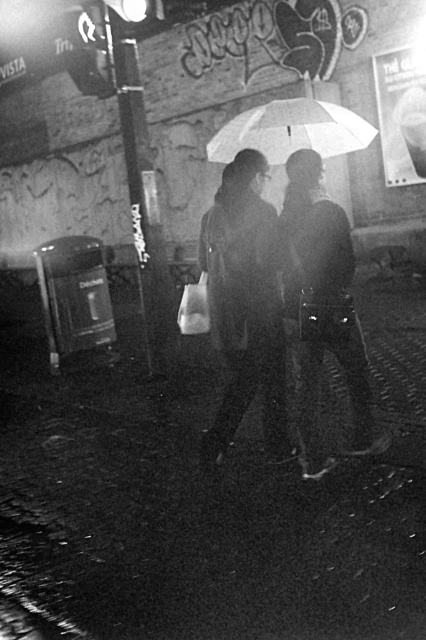
Can you confirm if matte black umbrella at center is wider than white matte umbrella at upper center?

Correct, the width of matte black umbrella at center exceeds that of white matte umbrella at upper center.

Who is positioned more to the right, matte black umbrella at center or white matte umbrella at upper center?

Positioned to the right is white matte umbrella at upper center.

Who is more distant from viewer, (299, 333) or (276, 116)?

The point (276, 116) is more distant.

This screenshot has width=426, height=640. Identify the location of matte black umbrella at center. (322, 307).